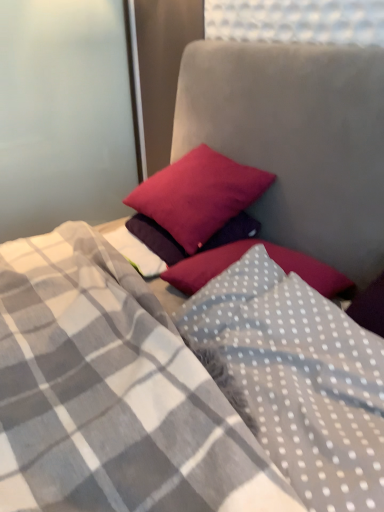
The height and width of the screenshot is (512, 384). What do you see at coordinates (198, 195) in the screenshot? I see `matte pink pillow at upper center, positioned as the 2th pillow in front-to-back order` at bounding box center [198, 195].

Where is `matte pink pillow at upper center, positioned as the first pillow in top-to-bottom order`? matte pink pillow at upper center, positioned as the first pillow in top-to-bottom order is located at coordinates (198, 195).

How much space does white dotted fabric pillow at center, which is counted as the 2th pillow, starting from the top, occupy vertically?

white dotted fabric pillow at center, which is counted as the 2th pillow, starting from the top, is 8.65 inches in height.

The height and width of the screenshot is (512, 384). Describe the element at coordinates (296, 379) in the screenshot. I see `white dotted fabric pillow at center, which is the 1th pillow from bottom to top` at that location.

At what (x,y) coordinates should I click in order to perform the action: click on white dotted fabric pillow at center, which ranks as the second pillow in back-to-front order. Please return your answer as a coordinate pair (x, y). The height and width of the screenshot is (512, 384). Looking at the image, I should click on (296, 379).

Locate an element on the screen. Image resolution: width=384 pixels, height=512 pixels. matte pink pillow at upper center, positioned as the first pillow in top-to-bottom order is located at coordinates (198, 195).

Based on their positions, is matte pink pillow at upper center, positioned as the first pillow in top-to-bottom order, located to the left or right of white dotted fabric pillow at center, the first pillow viewed from the front?

Clearly, matte pink pillow at upper center, positioned as the first pillow in top-to-bottom order, is on the left of white dotted fabric pillow at center, the first pillow viewed from the front, in the image.

Does matte pink pillow at upper center, positioned as the first pillow in top-to-bottom order, lie in front of white dotted fabric pillow at center, which ranks as the second pillow in back-to-front order?

No, it is not.

Does point (173, 191) come farther from viewer compared to point (264, 417)?

Yes, it is behind point (264, 417).

From the image's perspective, which object appears higher, matte pink pillow at upper center, positioned as the first pillow in top-to-bottom order, or white dotted fabric pillow at center, which is counted as the 2th pillow, starting from the top?

From the image's view, matte pink pillow at upper center, positioned as the first pillow in top-to-bottom order, is above.

From a real-world perspective, is matte pink pillow at upper center, the 2th pillow when ordered from bottom to top, above or below white dotted fabric pillow at center, which ranks as the second pillow in back-to-front order?

matte pink pillow at upper center, the 2th pillow when ordered from bottom to top, is situated higher than white dotted fabric pillow at center, which ranks as the second pillow in back-to-front order, in the real world.

Can you confirm if matte pink pillow at upper center, which is counted as the first pillow, starting from the back, is thinner than white dotted fabric pillow at center, the first pillow viewed from the front?

Yes, matte pink pillow at upper center, which is counted as the first pillow, starting from the back, is thinner than white dotted fabric pillow at center, the first pillow viewed from the front.

Considering the sizes of objects matte pink pillow at upper center, the 2th pillow when ordered from bottom to top, and white dotted fabric pillow at center, which is the 1th pillow from bottom to top, in the image provided, who is shorter, matte pink pillow at upper center, the 2th pillow when ordered from bottom to top, or white dotted fabric pillow at center, which is the 1th pillow from bottom to top,?

white dotted fabric pillow at center, which is the 1th pillow from bottom to top, is shorter.

Considering the sizes of matte pink pillow at upper center, which is counted as the first pillow, starting from the back, and white dotted fabric pillow at center, which ranks as the second pillow in back-to-front order, in the image, is matte pink pillow at upper center, which is counted as the first pillow, starting from the back, bigger or smaller than white dotted fabric pillow at center, which ranks as the second pillow in back-to-front order,?

Clearly, matte pink pillow at upper center, which is counted as the first pillow, starting from the back, is smaller in size than white dotted fabric pillow at center, which ranks as the second pillow in back-to-front order.

Is matte pink pillow at upper center, positioned as the first pillow in top-to-bottom order, located outside white dotted fabric pillow at center, which ranks as the second pillow in back-to-front order?

matte pink pillow at upper center, positioned as the first pillow in top-to-bottom order, is positioned outside white dotted fabric pillow at center, which ranks as the second pillow in back-to-front order.

Is matte pink pillow at upper center, positioned as the first pillow in top-to-bottom order, touching white dotted fabric pillow at center, which is the 1th pillow from bottom to top?

No, matte pink pillow at upper center, positioned as the first pillow in top-to-bottom order, is not with white dotted fabric pillow at center, which is the 1th pillow from bottom to top.

Could you tell me if matte pink pillow at upper center, the 2th pillow when ordered from bottom to top, is facing white dotted fabric pillow at center, which is the 1th pillow from bottom to top?

No, matte pink pillow at upper center, the 2th pillow when ordered from bottom to top, is not aimed at white dotted fabric pillow at center, which is the 1th pillow from bottom to top.

Measure the distance from matte pink pillow at upper center, the 2th pillow when ordered from bottom to top, to white dotted fabric pillow at center, which ranks as the second pillow in back-to-front order.

They are 19.01 inches apart.

The image size is (384, 512). Identify the location of pillow on the left side of white dotted fabric pillow at center, which is the 1th pillow from bottom to top. (198, 195).

Does white dotted fabric pillow at center, which is counted as the 2th pillow, starting from the top, appear on the right side of matte pink pillow at upper center, which is counted as the first pillow, starting from the back?

Yes, white dotted fabric pillow at center, which is counted as the 2th pillow, starting from the top, is to the right of matte pink pillow at upper center, which is counted as the first pillow, starting from the back.

Is white dotted fabric pillow at center, which ranks as the second pillow in back-to-front order, closer to camera compared to matte pink pillow at upper center, positioned as the first pillow in top-to-bottom order?

Yes, it is in front of matte pink pillow at upper center, positioned as the first pillow in top-to-bottom order.

Between point (261, 398) and point (172, 193), which one is positioned in front?

The point (261, 398) is closer to the camera.

From the image's perspective, is white dotted fabric pillow at center, which ranks as the second pillow in back-to-front order, on top of matte pink pillow at upper center, positioned as the 2th pillow in front-to-back order?

No, from the image's perspective, white dotted fabric pillow at center, which ranks as the second pillow in back-to-front order, is not on top of matte pink pillow at upper center, positioned as the 2th pillow in front-to-back order.

From a real-world perspective, is white dotted fabric pillow at center, the first pillow viewed from the front, above or below matte pink pillow at upper center, which is counted as the first pillow, starting from the back?

From a real-world perspective, white dotted fabric pillow at center, the first pillow viewed from the front, is physically below matte pink pillow at upper center, which is counted as the first pillow, starting from the back.

Is white dotted fabric pillow at center, which is the 1th pillow from bottom to top, thinner than matte pink pillow at upper center, positioned as the 2th pillow in front-to-back order?

In fact, white dotted fabric pillow at center, which is the 1th pillow from bottom to top, might be wider than matte pink pillow at upper center, positioned as the 2th pillow in front-to-back order.

Considering the sizes of objects white dotted fabric pillow at center, which is the 1th pillow from bottom to top, and matte pink pillow at upper center, the 2th pillow when ordered from bottom to top, in the image provided, who is shorter, white dotted fabric pillow at center, which is the 1th pillow from bottom to top, or matte pink pillow at upper center, the 2th pillow when ordered from bottom to top,?

With less height is white dotted fabric pillow at center, which is the 1th pillow from bottom to top.

Can you confirm if white dotted fabric pillow at center, which ranks as the second pillow in back-to-front order, is smaller than matte pink pillow at upper center, positioned as the first pillow in top-to-bottom order?

Incorrect, white dotted fabric pillow at center, which ranks as the second pillow in back-to-front order, is not smaller in size than matte pink pillow at upper center, positioned as the first pillow in top-to-bottom order.

Is matte pink pillow at upper center, positioned as the first pillow in top-to-bottom order, completely or partially inside white dotted fabric pillow at center, which is the 1th pillow from bottom to top?

No, matte pink pillow at upper center, positioned as the first pillow in top-to-bottom order, is not inside white dotted fabric pillow at center, which is the 1th pillow from bottom to top.

Is white dotted fabric pillow at center, the first pillow viewed from the front, far away from matte pink pillow at upper center, the 2th pillow when ordered from bottom to top?

No, white dotted fabric pillow at center, the first pillow viewed from the front, is in close proximity to matte pink pillow at upper center, the 2th pillow when ordered from bottom to top.

Is white dotted fabric pillow at center, the first pillow viewed from the front, oriented towards matte pink pillow at upper center, which is counted as the first pillow, starting from the back?

No, white dotted fabric pillow at center, the first pillow viewed from the front, is not facing towards matte pink pillow at upper center, which is counted as the first pillow, starting from the back.

How different are the orientations of white dotted fabric pillow at center, the first pillow viewed from the front, and matte pink pillow at upper center, which is counted as the first pillow, starting from the back, in degrees?

They differ by 3.18 degrees in their facing directions.

Find the location of a particular element. This screenshot has width=384, height=512. pillow that appears above the white dotted fabric pillow at center, which ranks as the second pillow in back-to-front order (from the image's perspective) is located at coordinates (198, 195).

Identify the location of pillow on the right side of matte pink pillow at upper center, which is counted as the first pillow, starting from the back. (296, 379).

Locate an element on the screen. pillow beneath the matte pink pillow at upper center, positioned as the 2th pillow in front-to-back order (from a real-world perspective) is located at coordinates (296, 379).